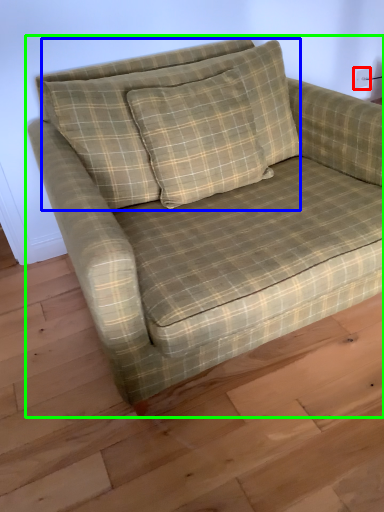
Question: Which object is positioned closest to electric outlet (highlighted by a red box)? Select from pillow (highlighted by a blue box) and studio couch (highlighted by a green box).

Choices:
 (A) pillow
 (B) studio couch

Answer: (A)